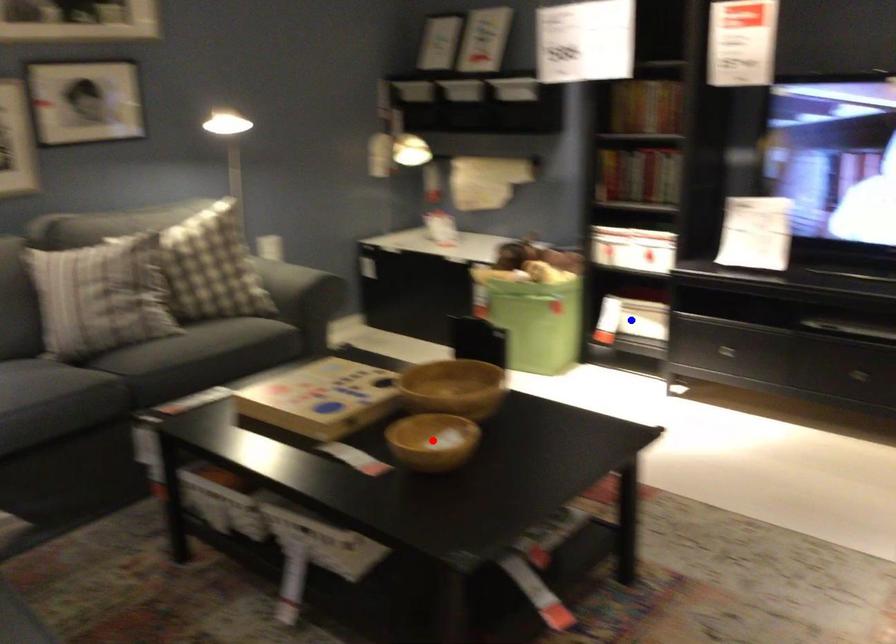
Question: In the image, two points are highlighted. Which point is nearer to the camera? Reply with the corresponding letter.

Choices:
 (A) blue point
 (B) red point

Answer: (B)